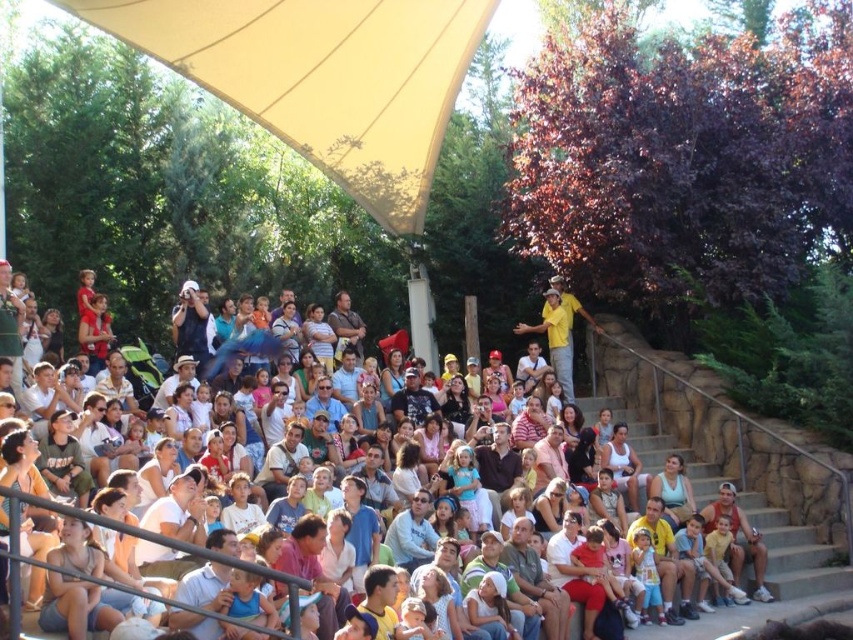
Question: Can you confirm if beige fabric canopy at upper left is positioned above matte black shirt at center?

Choices:
 (A) no
 (B) yes

Answer: (B)

Question: Which is farther from the beige fabric canopy at upper left?

Choices:
 (A) matte white crowd at center
 (B) white cotton tank top at center

Answer: (A)

Question: Can you confirm if matte black shirt at center is positioned to the left of light blue shirt at center?

Choices:
 (A) yes
 (B) no

Answer: (B)

Question: Among these points, which one is farthest from the camera?

Choices:
 (A) (303, 332)
 (B) (619, 449)
 (C) (408, 186)
 (D) (421, 404)

Answer: (C)

Question: Observing the image, what is the correct spatial positioning of matte white crowd at center in reference to light blue shirt at center?

Choices:
 (A) above
 (B) below

Answer: (B)

Question: Among these objects, which one is farthest from the camera?

Choices:
 (A) matte black shirt at center
 (B) white cotton tank top at center
 (C) beige fabric canopy at upper left

Answer: (C)